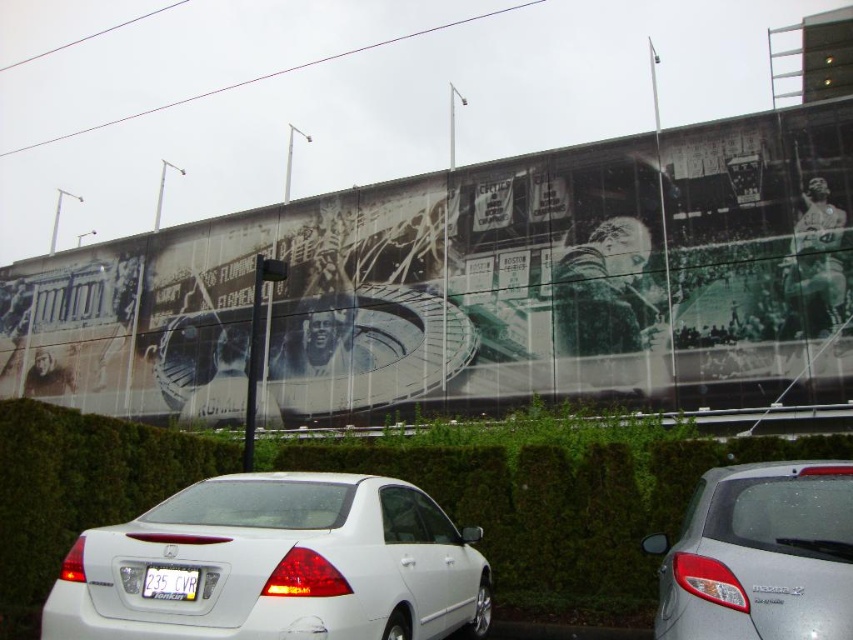
Is green leafy hedge at lower center closer to the viewer compared to white plastic license plate at center?

No, it is not.

In the scene shown: Is green leafy hedge at lower center above white plastic license plate at center?

Indeed, green leafy hedge at lower center is positioned over white plastic license plate at center.

Identify the location of green leafy hedge at lower center. The height and width of the screenshot is (640, 853). (561, 508).

Does green leafy hedge at lower center appear under silver metallic hatchback at center?

Actually, green leafy hedge at lower center is above silver metallic hatchback at center.

Based on the photo, can you confirm if green leafy hedge at lower center is positioned above silver metallic hatchback at center?

Yes.

Who is more distant from viewer, (786, 458) or (671, 582)?

The point (786, 458) is more distant.

This screenshot has width=853, height=640. In order to click on green leafy hedge at lower center in this screenshot , I will do `click(561, 508)`.

Between silver metallic hatchback at center and white plastic license plate at center, which one is positioned lower?

Positioned lower is white plastic license plate at center.

Locate an element on the screen. The height and width of the screenshot is (640, 853). silver metallic hatchback at center is located at coordinates (759, 556).